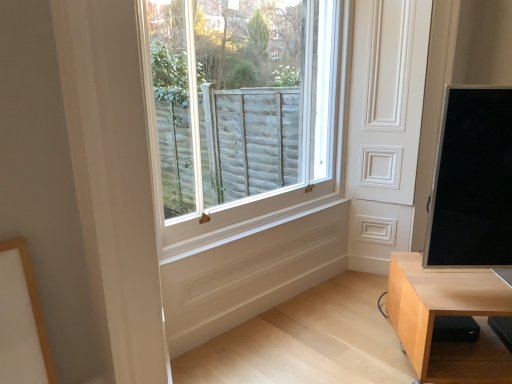
The image size is (512, 384). I want to click on white wooden window at center, so click(x=241, y=109).

In order to face white wooden window at center, should I rotate leftwards or rightwards?

To face it directly, rotate left by 0.038 degrees.

This screenshot has height=384, width=512. I want to click on black glossy screen at right, so click(472, 181).

How different are the orientations of light wood table at lower right and black glossy screen at right in degrees?

0.142 degrees separate the facing orientations of light wood table at lower right and black glossy screen at right.

From a real-world perspective, is light wood table at lower right on top of black glossy screen at right?

Incorrect, from a real-world perspective, light wood table at lower right is lower than black glossy screen at right.

Between light wood table at lower right and black glossy screen at right, which one appears on the right side from the viewer's perspective?

light wood table at lower right.

Identify the location of window screen in front of the light wood table at lower right. This screenshot has height=384, width=512. (472, 181).

The width and height of the screenshot is (512, 384). I want to click on table that is under the white wooden window at center (from a real-world perspective), so click(x=448, y=314).

Would you say light wood table at lower right is to the left or to the right of white wooden window at center in the picture?

light wood table at lower right is positioned on white wooden window at center's right side.

In the image, is light wood table at lower right positioned in front of or behind white wooden window at center?

light wood table at lower right is in front of white wooden window at center.

From a real-world perspective, relative to light wood table at lower right, is white wooden window at center vertically above or below?

From a real-world perspective, white wooden window at center is physically above light wood table at lower right.

Is light wood table at lower right at the back of white wooden window at center?

No.

Looking at this image, considering the sizes of objects white wooden window at center and light wood table at lower right in the image provided, who is shorter, white wooden window at center or light wood table at lower right?

With less height is light wood table at lower right.

This screenshot has height=384, width=512. In order to click on window screen that appears below the white wooden window at center (from a real-world perspective) in this screenshot , I will do `click(472, 181)`.

Which is more to the right, black glossy screen at right or white wooden window at center?

Positioned to the right is black glossy screen at right.

From a real-world perspective, is black glossy screen at right on white wooden window at center?

No, from a real-world perspective, black glossy screen at right is not above white wooden window at center.

In terms of width, does black glossy screen at right look wider or thinner when compared to white wooden window at center?

black glossy screen at right is wider than white wooden window at center.

Can you see white wooden window at center touching black glossy screen at right?

No, white wooden window at center is not next to black glossy screen at right.

Would you say white wooden window at center is outside black glossy screen at right?

Yes, white wooden window at center is outside of black glossy screen at right.

Based on the photo, how many degrees apart are the facing directions of white wooden window at center and black glossy screen at right?

43.9 degrees separate the facing orientations of white wooden window at center and black glossy screen at right.

Between white wooden window at center and black glossy screen at right, which one has less height?

Standing shorter between the two is black glossy screen at right.

Looking at this image, from a real-world perspective, relative to light wood table at lower right, is black glossy screen at right vertically above or below?

Clearly, from a real-world perspective, black glossy screen at right is above light wood table at lower right.

In terms of height, does black glossy screen at right look taller or shorter compared to light wood table at lower right?

In the image, black glossy screen at right appears to be taller than light wood table at lower right.

Considering the relative sizes of black glossy screen at right and light wood table at lower right in the image provided, is black glossy screen at right wider than light wood table at lower right?

No.

Is black glossy screen at right in contact with light wood table at lower right?

No, black glossy screen at right is not in contact with light wood table at lower right.

The width and height of the screenshot is (512, 384). Find the location of `window screen in front of the light wood table at lower right`. window screen in front of the light wood table at lower right is located at coordinates (472, 181).

Identify the location of window above the light wood table at lower right (from the image's perspective). This screenshot has width=512, height=384. click(241, 109).

Estimate the real-world distances between objects in this image. Which object is further from black glossy screen at right, light wood table at lower right or white wooden window at center?

The object further to black glossy screen at right is white wooden window at center.

Based on their spatial positions, is light wood table at lower right or black glossy screen at right further from white wooden window at center?

The object further to white wooden window at center is black glossy screen at right.

Which object lies nearer to the anchor point black glossy screen at right, white wooden window at center or light wood table at lower right?

light wood table at lower right.

From the image, which object appears to be nearer to white wooden window at center, black glossy screen at right or light wood table at lower right?

light wood table at lower right is closer to white wooden window at center.

Estimate the real-world distances between objects in this image. Which object is further from light wood table at lower right, white wooden window at center or black glossy screen at right?

Among the two, white wooden window at center is located further to light wood table at lower right.

From the picture: Considering their positions, is black glossy screen at right positioned closer to light wood table at lower right than white wooden window at center?

black glossy screen at right is closer to light wood table at lower right.

The image size is (512, 384). In order to click on window screen between white wooden window at center and light wood table at lower right in this screenshot , I will do `click(472, 181)`.